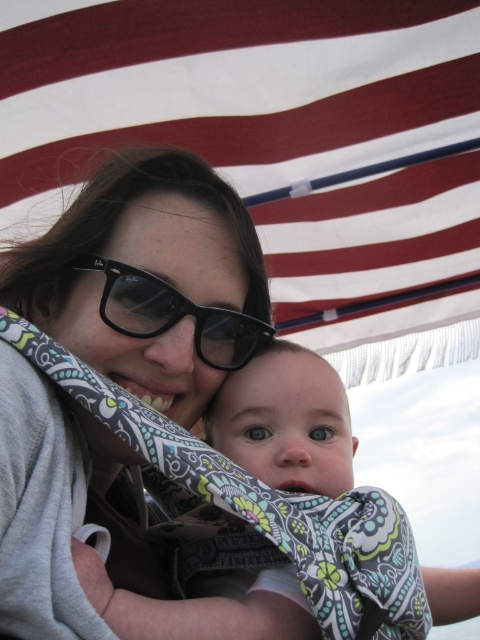
Is white striped fabric at upper center thinner than matte black sunglasses at center?

No.

Between white striped fabric at upper center and matte black sunglasses at center, which one has more height?

white striped fabric at upper center

I want to click on white striped fabric at upper center, so click(x=278, y=147).

Locate an element on the screen. This screenshot has height=640, width=480. white striped fabric at upper center is located at coordinates (278, 147).

Is white striped fabric at upper center shorter than black plastic glasses at center?

In fact, white striped fabric at upper center may be taller than black plastic glasses at center.

Consider the image. Is white striped fabric at upper center above black plastic glasses at center?

Indeed, white striped fabric at upper center is positioned over black plastic glasses at center.

At what (x,y) coordinates should I click in order to perform the action: click on white striped fabric at upper center. Please return your answer as a coordinate pair (x, y). Image resolution: width=480 pixels, height=640 pixels. Looking at the image, I should click on (278, 147).

Identify the location of white striped fabric at upper center. (278, 147).

This screenshot has height=640, width=480. What do you see at coordinates (148, 280) in the screenshot?
I see `matte black sunglasses at center` at bounding box center [148, 280].

Does matte black sunglasses at center have a lesser height compared to black plastic glasses at center?

No, matte black sunglasses at center is not shorter than black plastic glasses at center.

Which is behind, point (71, 554) or point (229, 317)?

Positioned behind is point (229, 317).

Identify the location of matte black sunglasses at center. The width and height of the screenshot is (480, 640). (148, 280).